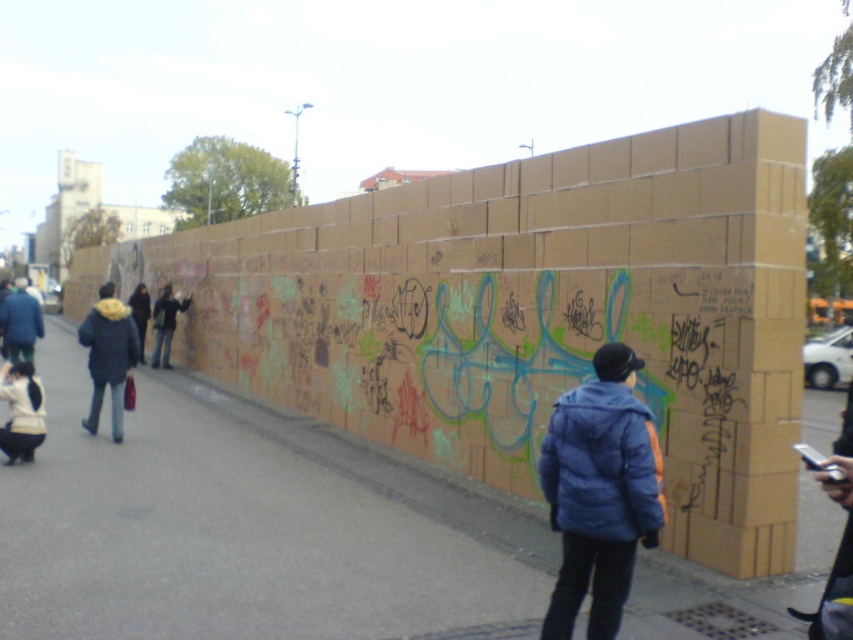
Is blue down jacket at center bigger than matte blue jacket at left?

Incorrect, blue down jacket at center is not larger than matte blue jacket at left.

Can you confirm if blue down jacket at center is positioned below matte blue jacket at left?

Yes.

The height and width of the screenshot is (640, 853). In order to click on blue down jacket at center in this screenshot , I will do `click(601, 465)`.

I want to click on blue down jacket at center, so click(x=601, y=465).

Measure the distance from matte blue jacket at left to dark blue jacket at center.

matte blue jacket at left is 6.62 meters from dark blue jacket at center.

Is matte blue jacket at left positioned in front of dark blue jacket at center?

That is True.

Where is `matte blue jacket at left`? Image resolution: width=853 pixels, height=640 pixels. matte blue jacket at left is located at coordinates (109, 340).

Between brown cardboard wall at center and dark blue puffy jacket at center, which one has more height?

dark blue puffy jacket at center is taller.

Is brown cardboard wall at center smaller than dark blue puffy jacket at center?

Actually, brown cardboard wall at center might be larger than dark blue puffy jacket at center.

Image resolution: width=853 pixels, height=640 pixels. What do you see at coordinates (248, 531) in the screenshot? I see `brown cardboard wall at center` at bounding box center [248, 531].

Where is `brown cardboard wall at center`? This screenshot has width=853, height=640. brown cardboard wall at center is located at coordinates (248, 531).